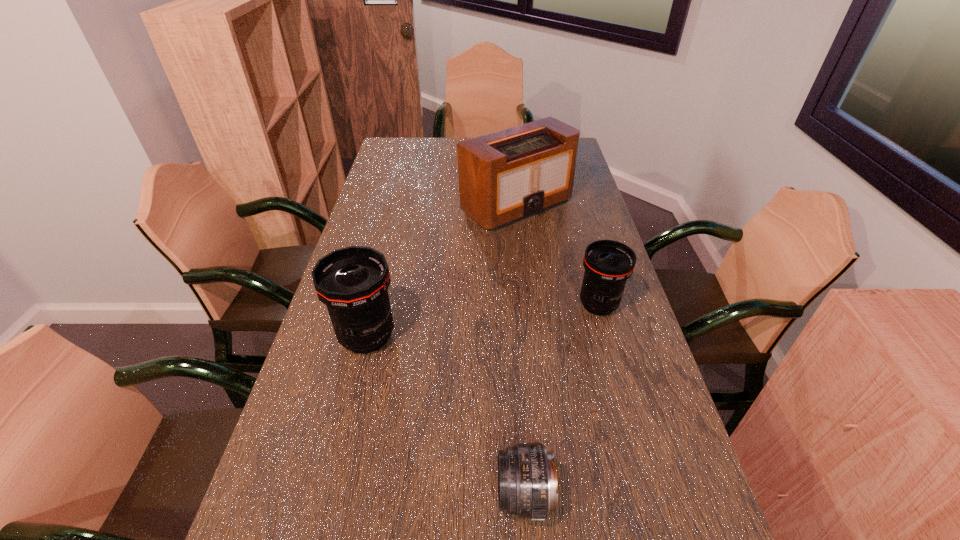
Find the location of a particular element. Image resolution: width=960 pixels, height=540 pixels. object that can be found as the third closest to the second shortest object is located at coordinates (352, 282).

The height and width of the screenshot is (540, 960). I want to click on object that ranks as the closest to the radio receiver, so click(608, 264).

Identify which telephoto lens is located as the nearest to the shortest object. Please provide its 2D coordinates. Your answer should be formatted as a tuple, i.e. [(x, y)], where the tuple contains the x and y coordinates of a point satisfying the conditions above.

[(352, 282)]

Identify which telephoto lens is the closest to the leftmost telephoto lens. Please provide its 2D coordinates. Your answer should be formatted as a tuple, i.e. [(x, y)], where the tuple contains the x and y coordinates of a point satisfying the conditions above.

[(527, 480)]

Locate an element on the screen. The image size is (960, 540). blank space that satisfies the following two spatial constraints: 1. on the front side of the farthest object; 2. at the front element of the nearest telephoto lens is located at coordinates [548, 495].